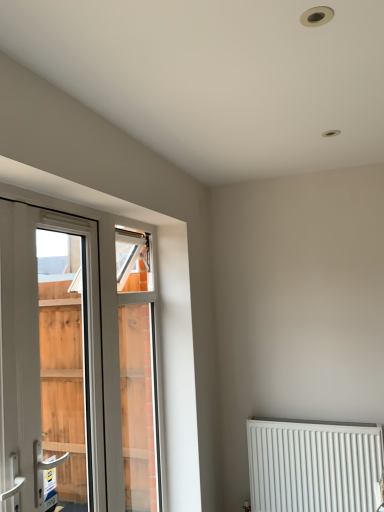
Question: From a real-world perspective, is white plastic window at left located higher than white metal radiator at lower right?

Choices:
 (A) no
 (B) yes

Answer: (B)

Question: Is white plastic window at left oriented away from white metal radiator at lower right?

Choices:
 (A) no
 (B) yes

Answer: (A)

Question: Is white metal radiator at lower right located within white plastic window at left?

Choices:
 (A) no
 (B) yes

Answer: (A)

Question: From the image's perspective, is white plastic window at left on white metal radiator at lower right?

Choices:
 (A) yes
 (B) no

Answer: (A)

Question: Is white plastic window at left bigger than white metal radiator at lower right?

Choices:
 (A) yes
 (B) no

Answer: (A)

Question: Is white plastic window at left at the right side of white metal radiator at lower right?

Choices:
 (A) no
 (B) yes

Answer: (A)

Question: Is white metal radiator at lower right positioned with its back to white plastic window at left?

Choices:
 (A) no
 (B) yes

Answer: (A)

Question: From a real-world perspective, is white metal radiator at lower right under white plastic window at left?

Choices:
 (A) yes
 (B) no

Answer: (A)

Question: Considering the relative sizes of white metal radiator at lower right and white plastic window at left in the image provided, is white metal radiator at lower right bigger than white plastic window at left?

Choices:
 (A) yes
 (B) no

Answer: (B)

Question: Would you say white plastic window at left is part of white metal radiator at lower right's contents?

Choices:
 (A) yes
 (B) no

Answer: (B)

Question: From the image's perspective, is white metal radiator at lower right above white plastic window at left?

Choices:
 (A) yes
 (B) no

Answer: (B)

Question: Is white metal radiator at lower right in contact with white plastic window at left?

Choices:
 (A) yes
 (B) no

Answer: (B)

Question: From the image's perspective, is white plastic window at left located above or below white metal radiator at lower right?

Choices:
 (A) above
 (B) below

Answer: (A)